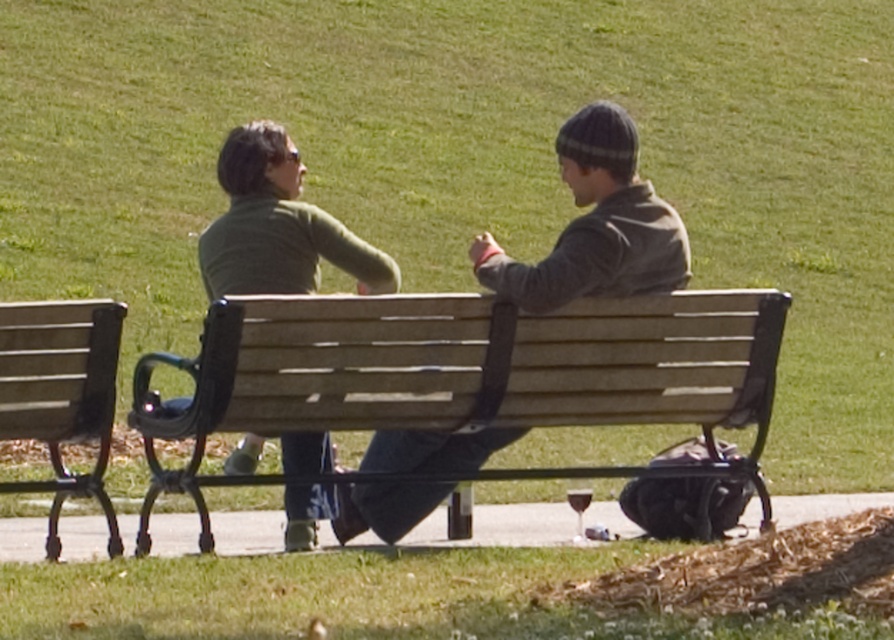
Based on the photo, does matte green sweater at center have a larger size compared to wooden bench at left?

Incorrect, matte green sweater at center is not larger than wooden bench at left.

The image size is (894, 640). What do you see at coordinates (595, 225) in the screenshot?
I see `matte green sweater at center` at bounding box center [595, 225].

Who is more forward, (478, 237) or (64, 369)?

Point (64, 369)

Locate an element on the screen. Image resolution: width=894 pixels, height=640 pixels. matte green sweater at center is located at coordinates (595, 225).

Is point (667, 330) behind point (112, 412)?

Yes.

Where is `wooden bench at center`? This screenshot has width=894, height=640. wooden bench at center is located at coordinates (465, 378).

This screenshot has height=640, width=894. Find the location of `wooden bench at center`. wooden bench at center is located at coordinates (465, 378).

Does wooden bench at center have a larger size compared to matte green sweater at center?

Correct, wooden bench at center is larger in size than matte green sweater at center.

What do you see at coordinates (465, 378) in the screenshot? This screenshot has height=640, width=894. I see `wooden bench at center` at bounding box center [465, 378].

Locate an element on the screen. wooden bench at center is located at coordinates (465, 378).